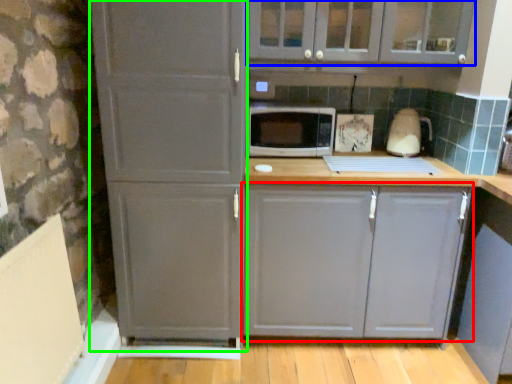
Question: Which is farther away from cabinetry (highlighted by a red box)? cabinetry (highlighted by a blue box) or screen door (highlighted by a green box)?

Choices:
 (A) cabinetry
 (B) screen door

Answer: (A)